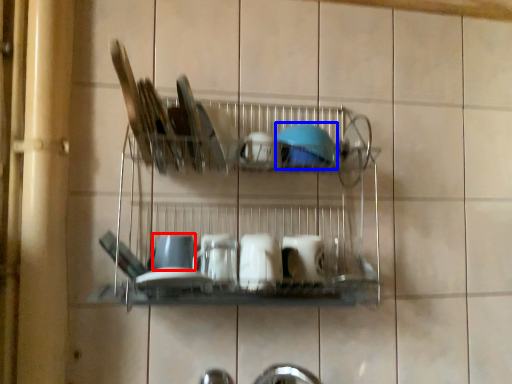
Question: Which object appears closest to the camera in this image, tableware (highlighted by a red box) or tableware (highlighted by a blue box)?

Choices:
 (A) tableware
 (B) tableware

Answer: (A)